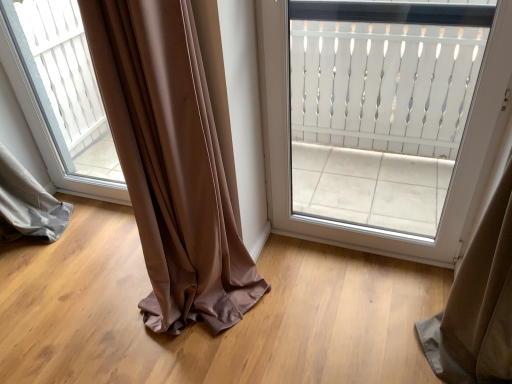
Question: From the image's perspective, is transparent glass window at center over white textured door at upper center?

Choices:
 (A) no
 (B) yes

Answer: (B)

Question: From a real-world perspective, is transparent glass window at center physically above white textured door at upper center?

Choices:
 (A) no
 (B) yes

Answer: (A)

Question: From the image's perspective, is transparent glass window at center located beneath white textured door at upper center?

Choices:
 (A) no
 (B) yes

Answer: (A)

Question: Considering the relative positions of transparent glass window at center and white textured door at upper center in the image provided, is transparent glass window at center to the right of white textured door at upper center from the viewer's perspective?

Choices:
 (A) yes
 (B) no

Answer: (B)

Question: Is transparent glass window at center at the left side of white textured door at upper center?

Choices:
 (A) no
 (B) yes

Answer: (B)

Question: Is transparent glass window at center oriented away from white textured door at upper center?

Choices:
 (A) no
 (B) yes

Answer: (A)

Question: Does white textured door at upper center have a greater width compared to transparent glass window at center?

Choices:
 (A) yes
 (B) no

Answer: (A)

Question: Is white textured door at upper center at the right side of transparent glass window at center?

Choices:
 (A) yes
 (B) no

Answer: (A)

Question: Considering the relative sizes of white textured door at upper center and transparent glass window at center in the image provided, is white textured door at upper center smaller than transparent glass window at center?

Choices:
 (A) no
 (B) yes

Answer: (A)

Question: From the image's perspective, would you say white textured door at upper center is shown under transparent glass window at center?

Choices:
 (A) yes
 (B) no

Answer: (A)

Question: Is transparent glass window at center completely or partially inside white textured door at upper center?

Choices:
 (A) no
 (B) yes

Answer: (A)

Question: From the image's perspective, is white textured door at upper center on top of transparent glass window at center?

Choices:
 (A) no
 (B) yes

Answer: (A)

Question: In terms of height, does white textured door at upper center look taller or shorter compared to transparent glass window at center?

Choices:
 (A) short
 (B) tall

Answer: (B)